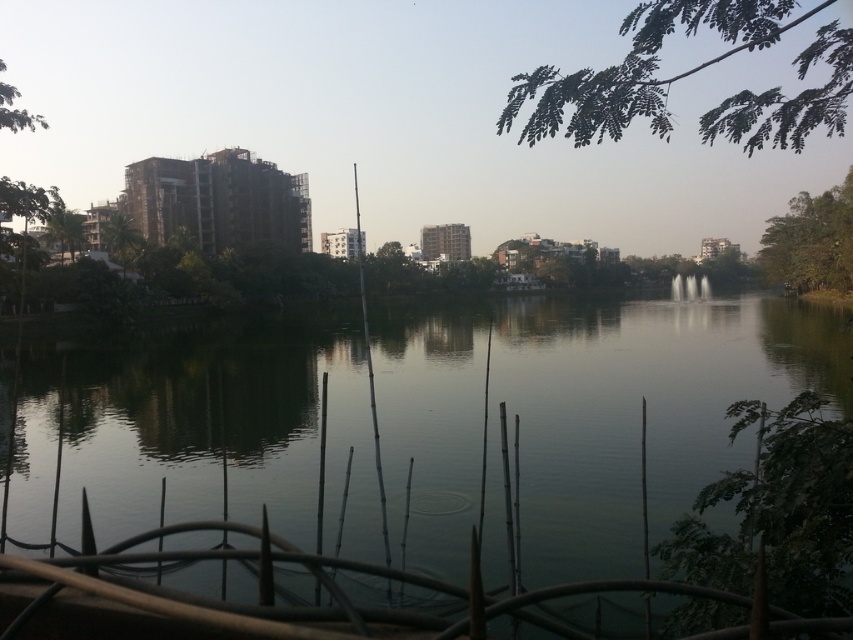
Question: Among these objects, which one is farthest from the camera?

Choices:
 (A) green leafy tree at upper left
 (B) green leafy tree at lower right
 (C) green leafy branch at upper right
 (D) green reflective water at center

Answer: (A)

Question: Among these points, which one is farthest from the camera?

Choices:
 (A) 804,220
 (B) 35,467

Answer: (A)

Question: Can you confirm if green leafy tree at lower right is bigger than green leafy tree at left?

Choices:
 (A) yes
 (B) no

Answer: (B)

Question: Which object appears closest to the camera in this image?

Choices:
 (A) green leafy tree at left
 (B) green leafy tree at upper left
 (C) green leafy tree at lower right
 (D) green leafy tree at right

Answer: (C)

Question: Does green reflective water at center have a greater width compared to green leafy tree at left?

Choices:
 (A) no
 (B) yes

Answer: (B)

Question: Is green reflective water at center to the left of green leafy tree at upper left from the viewer's perspective?

Choices:
 (A) yes
 (B) no

Answer: (B)